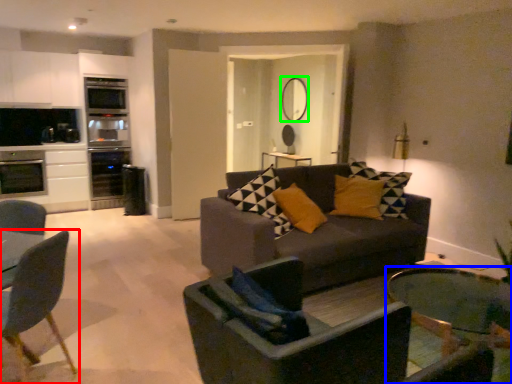
Question: Estimate the real-world distances between objects in this image. Which object is closer to chair (highlighted by a red box), coffee table (highlighted by a blue box) or mirror (highlighted by a green box)?

Choices:
 (A) coffee table
 (B) mirror

Answer: (A)